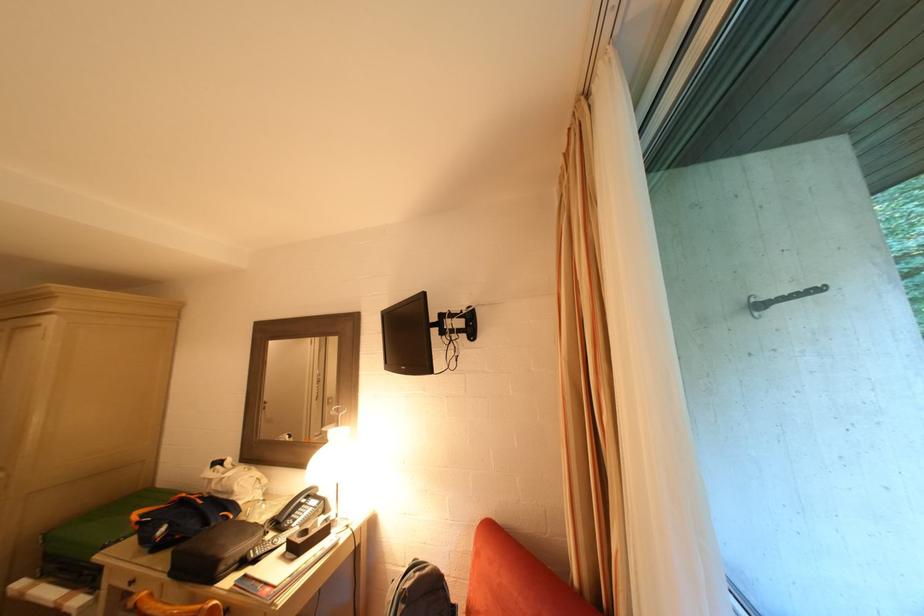
You are a GUI agent. You are given a task and a screenshot of the screen. Output one action in this format:
    pyautogui.click(x=<x>, y=<y>)
    Task: Click on the telephone handset
    
    Given the screenshot: What is the action you would take?
    pyautogui.click(x=299, y=509)